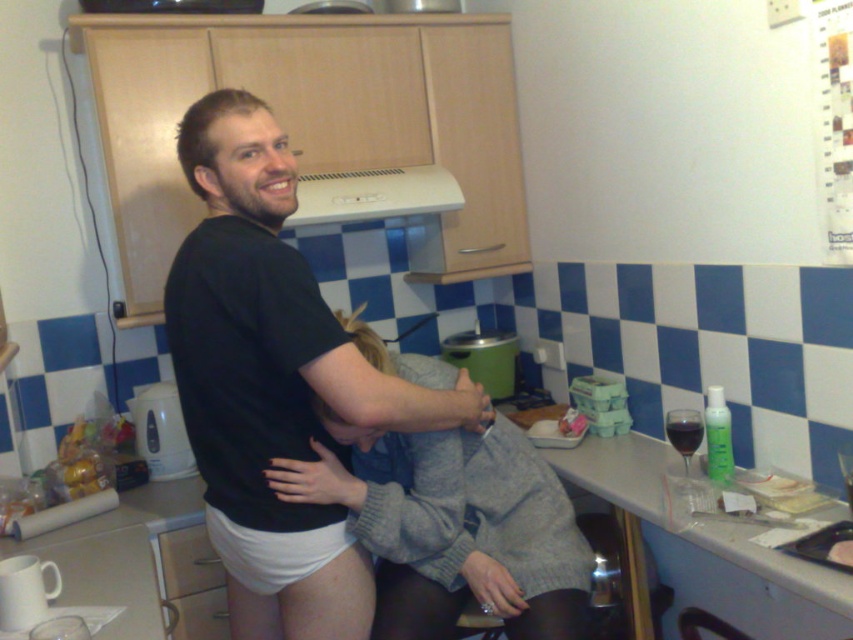
Question: Is gray sweater at center above white plastic exhaust hood at upper center?

Choices:
 (A) yes
 (B) no

Answer: (B)

Question: Which point appears closest to the camera in this image?

Choices:
 (A) (312, 369)
 (B) (581, 476)

Answer: (A)

Question: Can you confirm if gray sweater at center is wider than white laminate counter at center?

Choices:
 (A) yes
 (B) no

Answer: (A)

Question: Can you confirm if white matte underwear at center is bigger than gray sweater at center?

Choices:
 (A) no
 (B) yes

Answer: (B)

Question: Estimate the real-world distances between objects in this image. Which object is farther from the white matte underwear at center?

Choices:
 (A) gray sweater at center
 (B) white laminate counter at center
 (C) white plastic exhaust hood at upper center

Answer: (B)

Question: Among these objects, which one is nearest to the camera?

Choices:
 (A) white matte underwear at center
 (B) gray sweater at center
 (C) white laminate counter at center

Answer: (C)